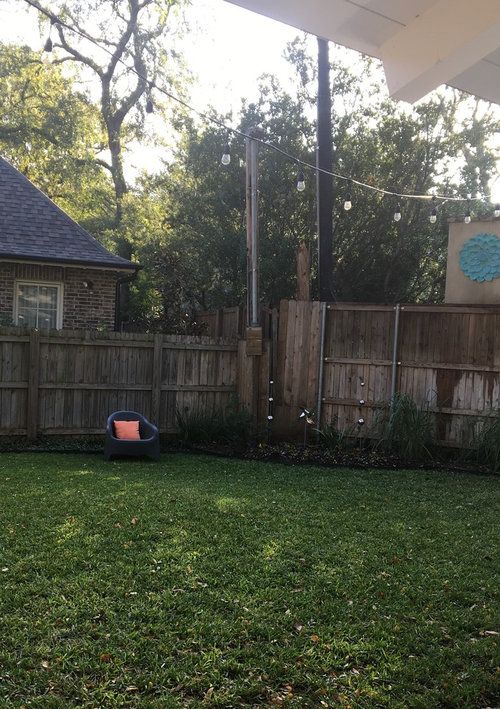
This screenshot has height=709, width=500. What are the coordinates of `pillow` in the screenshot? It's located at (125, 432).